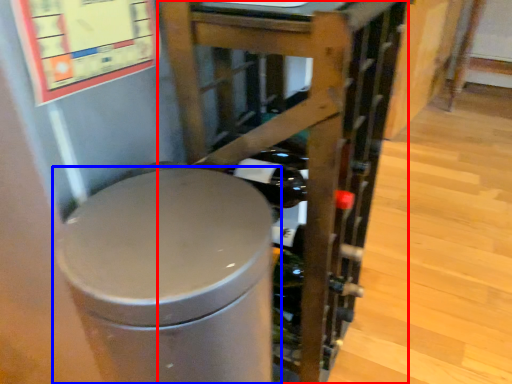
Question: Which object appears closest to the camera in this image, furniture (highlighted by a red box) or waste container (highlighted by a blue box)?

Choices:
 (A) furniture
 (B) waste container

Answer: (B)